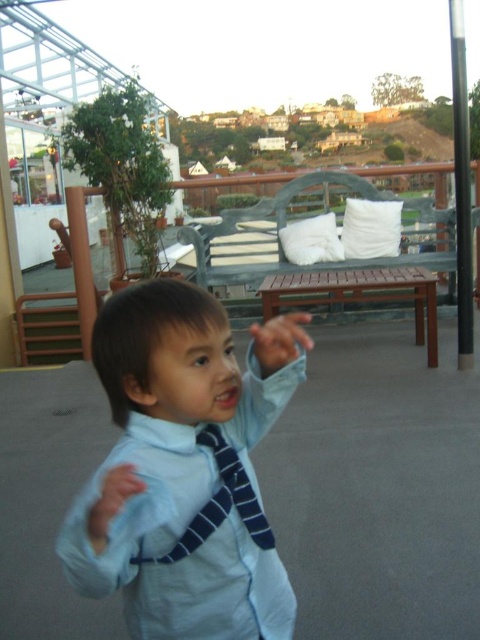
You are a fashion designer observing the child in the scene. You need to determine which item of clothing, the light blue shirt at center or the matte blue tie at center, requires more fabric to create. Which one would you choose?

The light blue shirt at center is larger in size than the matte blue tie at center, so it requires more fabric to create.

You are a tailor measuring two ties for a client. The client wants to know if the blue striped tie at center and the matte blue tie at center can be placed side by side in a display case that is 19 inches wide. Can they fit without overlapping?

The blue striped tie at center is 9.88 inches from matte blue tie at center. Since the total distance between them is 9.88 inches and the display case is 19 inches wide, they can fit side by side with space to spare.

You are a tailor observing a child wearing a light blue shirt at center and a matte blue tie at center. Which clothing item is taller?

The light blue shirt at center is taller than the matte blue tie at center.